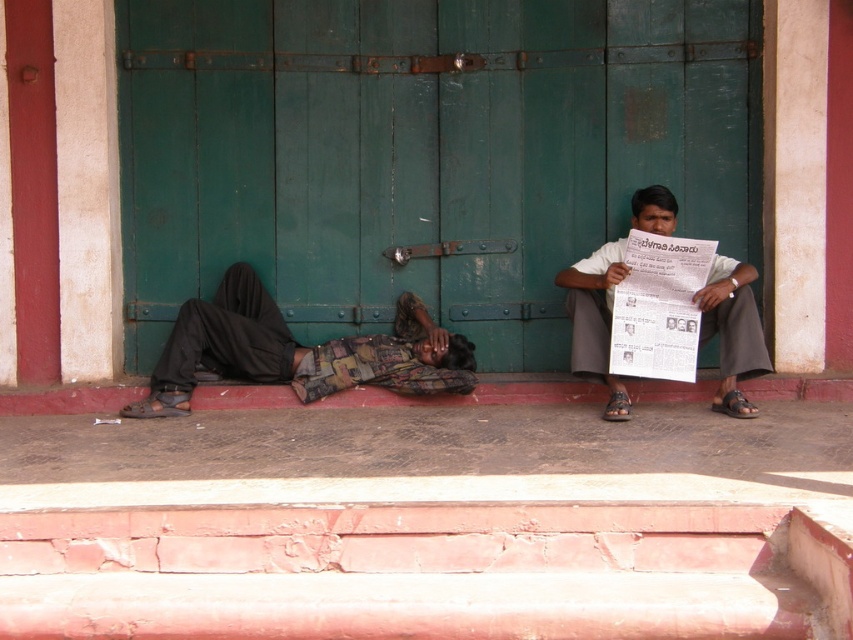
Question: Can you confirm if green wooden door at center is bigger than white paper at right?

Choices:
 (A) yes
 (B) no

Answer: (A)

Question: Does camouflage-patterned fabric at lower left appear over white paper at right?

Choices:
 (A) no
 (B) yes

Answer: (A)

Question: Which point is closer to the camera?

Choices:
 (A) camouflage-patterned fabric at lower left
 (B) green wooden door at center

Answer: (A)

Question: Which point is farther to the camera?

Choices:
 (A) camouflage-patterned fabric at lower left
 (B) white paper at right

Answer: (A)

Question: Does green wooden door at center appear over camouflage-patterned fabric at lower left?

Choices:
 (A) no
 (B) yes

Answer: (B)

Question: Which object is farther from the camera taking this photo?

Choices:
 (A) green wooden door at center
 (B) camouflage-patterned fabric at lower left
 (C) white paper at right

Answer: (A)